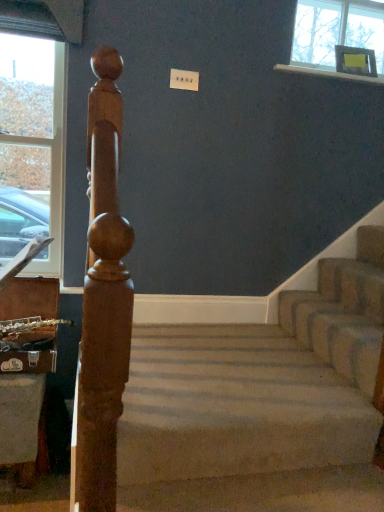
Question: Is carpeted stairs at center wider or thinner than white glossy window sill at upper right?

Choices:
 (A) thin
 (B) wide

Answer: (B)

Question: Is carpeted stairs at center in front of or behind white glossy window sill at upper right in the image?

Choices:
 (A) front
 (B) behind

Answer: (A)

Question: Based on their relative distances, which object is nearer to the clear glass window at left?

Choices:
 (A) beige carpeted stairs at center
 (B) carpeted stairs at center
 (C) white glossy window sill at upper right
 (D) polished wood post at left

Answer: (A)

Question: Which is farther from the polished wood post at left?

Choices:
 (A) beige carpeted stairs at center
 (B) white glossy window sill at upper right
 (C) carpeted stairs at center
 (D) clear glass window at left

Answer: (B)